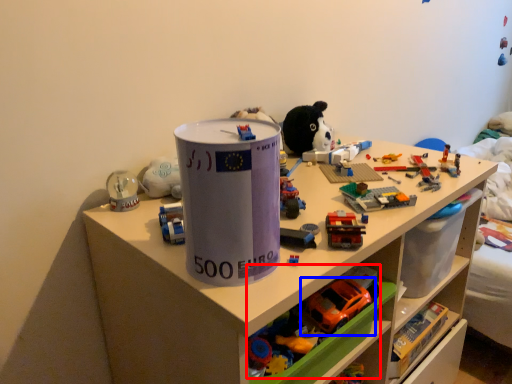
Question: Which object appears closest to the camera in this image, toy (highlighted by a red box) or toy (highlighted by a blue box)?

Choices:
 (A) toy
 (B) toy

Answer: (A)